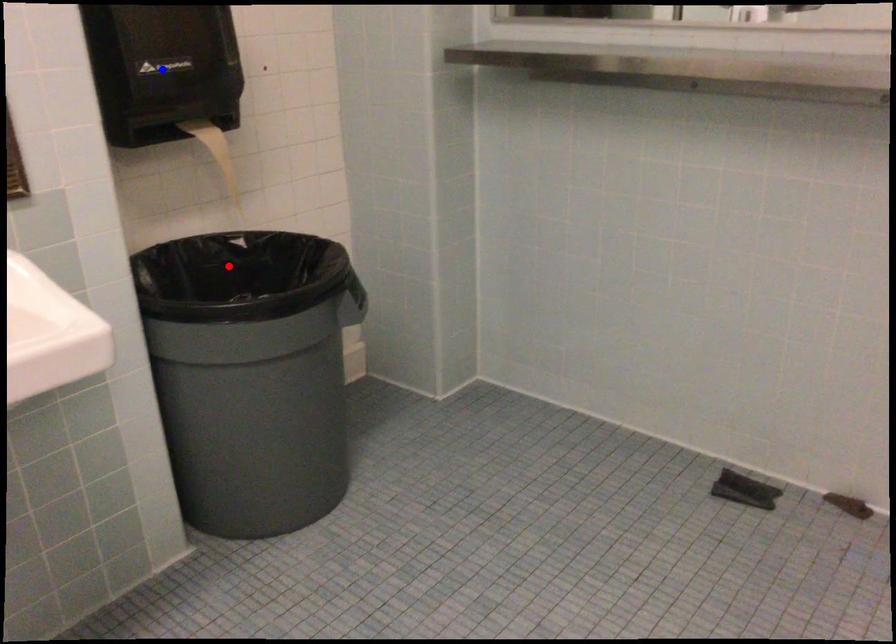
Question: In the image, two points are highlighted. Which point is nearer to the camera? Reply with the corresponding letter.

Choices:
 (A) blue point
 (B) red point

Answer: (A)